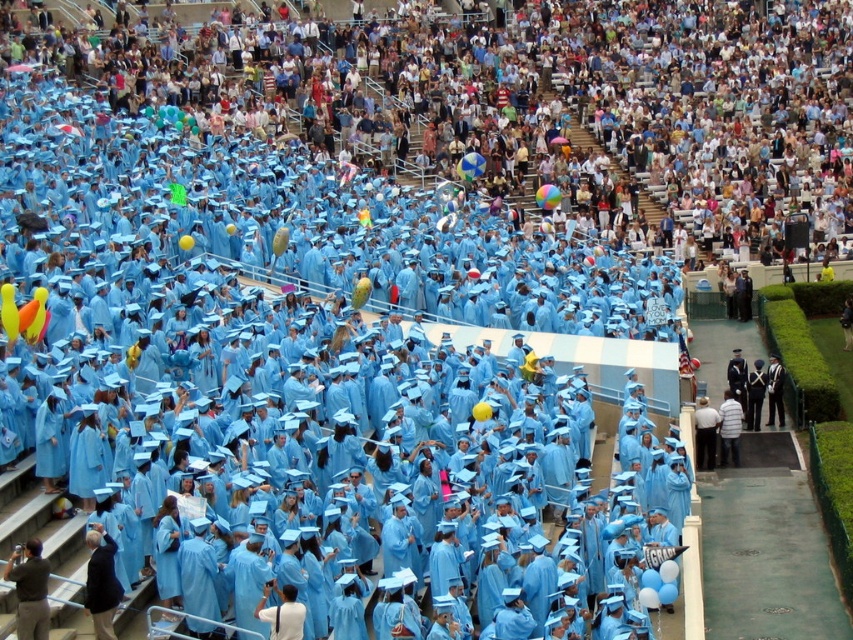
Question: Which of the following is the closest to the observer?

Choices:
 (A) black uniform at center
 (B) dark gray uniform at lower left

Answer: (B)

Question: Does dark gray uniform at lower left appear under black uniform at center?

Choices:
 (A) yes
 (B) no

Answer: (A)

Question: Does dark gray uniform at lower left have a smaller size compared to black uniform at center?

Choices:
 (A) no
 (B) yes

Answer: (A)

Question: Which point is closer to the camera?

Choices:
 (A) dark gray uniform at lower left
 (B) black uniform at center

Answer: (A)

Question: Observing the image, what is the correct spatial positioning of dark gray uniform at lower left in reference to black uniform at center?

Choices:
 (A) right
 (B) left

Answer: (B)